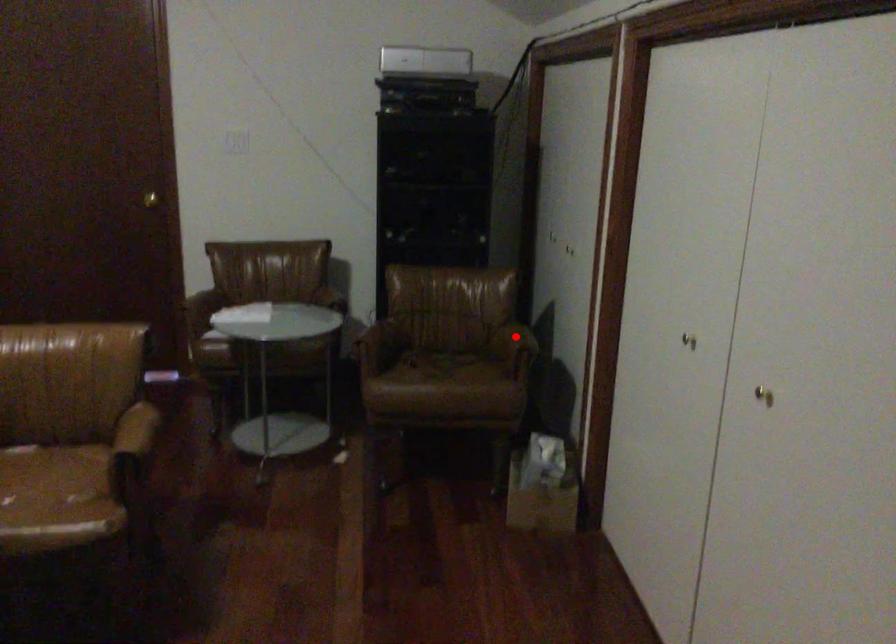
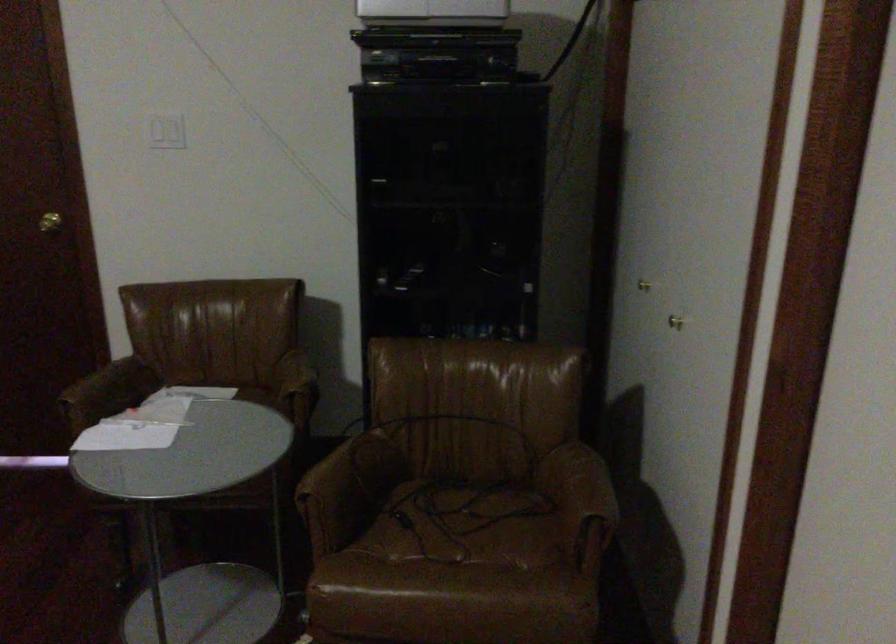
Question: I am providing you with two images of the same scene from different viewpoints. In image1, a red point is highlighted. Considering the same 3D point in image2, which of the following is correct?

Choices:
 (A) It is closer
 (B) It is farther

Answer: (A)